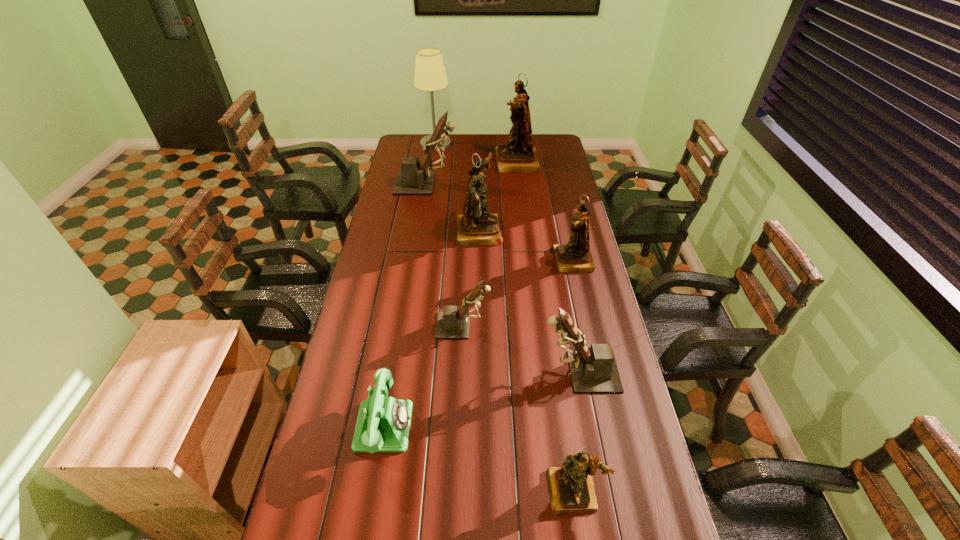
Locate an element on the screen. Image resolution: width=960 pixels, height=540 pixels. table lamp situated at the far edge is located at coordinates (430, 75).

In order to click on figurine present at the far edge in this screenshot , I will do `click(518, 155)`.

You are a GUI agent. You are given a task and a screenshot of the screen. Output one action in this format:
    pyautogui.click(x=<x>, y=<y>)
    Task: Click on the table lamp at the left edge
    The height and width of the screenshot is (540, 960).
    Given the screenshot: What is the action you would take?
    pyautogui.click(x=430, y=75)

Where is `figurine at the left edge`? figurine at the left edge is located at coordinates (413, 179).

Where is `telephone present at the left edge`? This screenshot has width=960, height=540. telephone present at the left edge is located at coordinates (383, 424).

Identify the location of object located in the far left corner section of the desktop. (430, 75).

Locate an element on the screen. This screenshot has width=960, height=540. object that is positioned at the far right corner is located at coordinates (518, 155).

Identify the location of free space at the left edge of the desktop. This screenshot has height=540, width=960. (391, 275).

Find the location of a particular element. The width and height of the screenshot is (960, 540). vacant space at the right edge of the desktop is located at coordinates [558, 172].

You are a GUI agent. You are given a task and a screenshot of the screen. Output one action in this format:
    pyautogui.click(x=<x>, y=<y>)
    Task: Click on the vacant point located between the shortest object and the smallest brown figurine
    The image size is (960, 540).
    Given the screenshot: What is the action you would take?
    pyautogui.click(x=423, y=376)